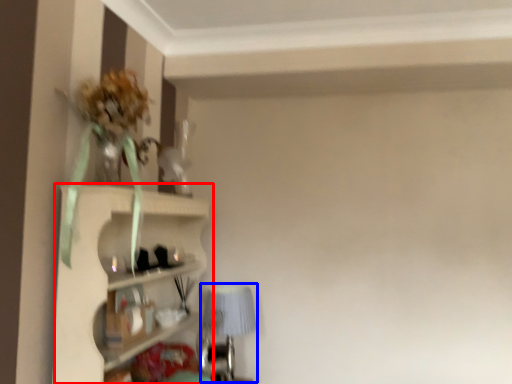
Question: Which object appears closest to the camera in this image, shelf (highlighted by a red box) or table lamp (highlighted by a blue box)?

Choices:
 (A) shelf
 (B) table lamp

Answer: (A)